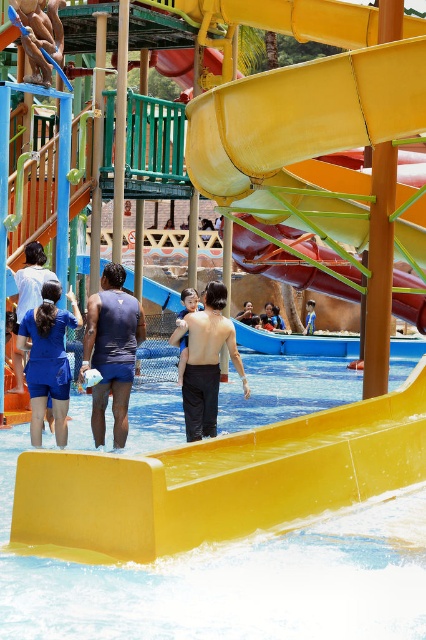
You are a lifeguard at the water park and need to ensure safety. The yellow plastic pool at center and the blue fabric dress at left are both in your line of sight. Which object is wider from your perspective?

The yellow plastic pool at center is wider than the blue fabric dress at left according to the description.

You are standing at the entrance of the water park and want to locate the yellow plastic pool at center. Based on the coordinates provided, where would you find it?

The yellow plastic pool at center is located at coordinates point (230, 580).